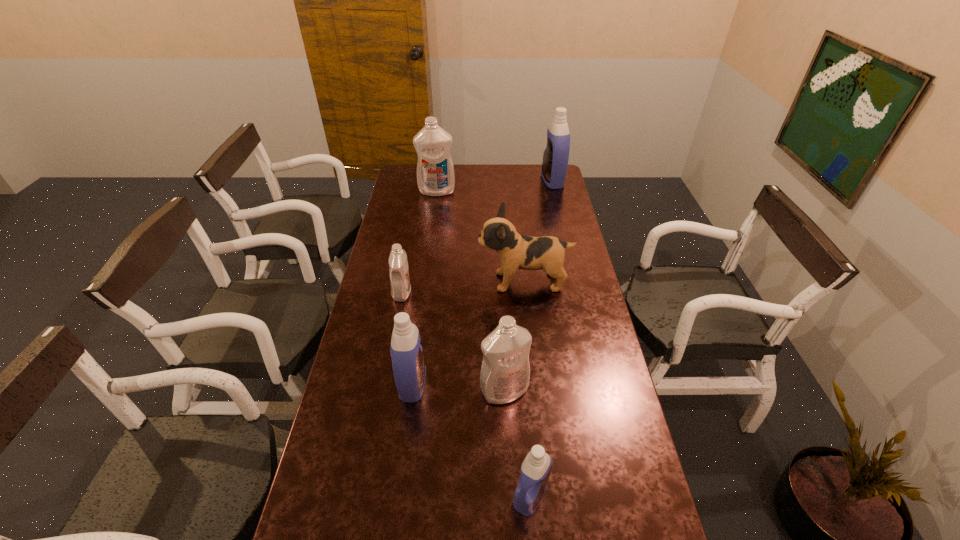
What are the coordinates of `the biggest white detergent` in the screenshot? It's located at (435, 172).

I want to click on the farthest blue detergent, so click(556, 155).

The image size is (960, 540). In order to click on the rightmost blue detergent in this screenshot , I will do `click(556, 155)`.

In order to click on puppy in this screenshot , I will do `click(516, 251)`.

Image resolution: width=960 pixels, height=540 pixels. I want to click on the nearest white detergent, so click(505, 372).

You are a GUI agent. You are given a task and a screenshot of the screen. Output one action in this format:
    pyautogui.click(x=<x>, y=<y>)
    Task: Click on the second smallest white detergent
    
    Given the screenshot: What is the action you would take?
    pyautogui.click(x=505, y=372)

You are a GUI agent. You are given a task and a screenshot of the screen. Output one action in this format:
    pyautogui.click(x=<x>, y=<y>)
    Task: Click on the second biggest blue detergent
    The width and height of the screenshot is (960, 540).
    Given the screenshot: What is the action you would take?
    pyautogui.click(x=409, y=369)

At what (x,y) coordinates should I click in order to perform the action: click on the second farthest blue detergent. Please return your answer as a coordinate pair (x, y). This screenshot has width=960, height=540. Looking at the image, I should click on (409, 369).

Locate an element on the screen. Image resolution: width=960 pixels, height=540 pixels. the fourth nearest detergent is located at coordinates (400, 284).

At what (x,y) coordinates should I click in order to perform the action: click on the second nearest white detergent. Please return your answer as a coordinate pair (x, y). Image resolution: width=960 pixels, height=540 pixels. Looking at the image, I should click on (400, 284).